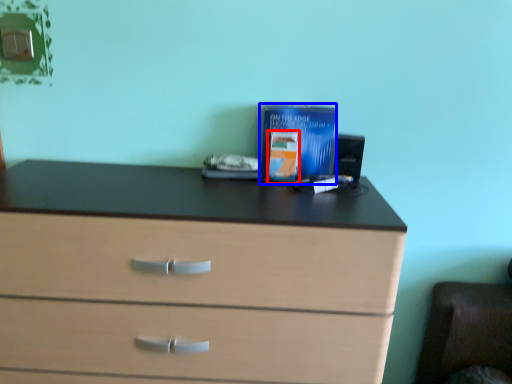
Question: Which of the following is the farthest to the observer, paperback book (highlighted by a red box) or paperback book (highlighted by a blue box)?

Choices:
 (A) paperback book
 (B) paperback book

Answer: (B)